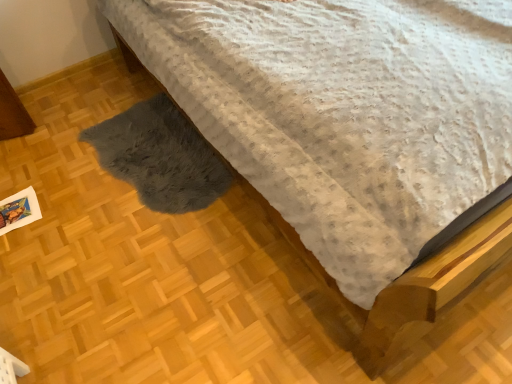
Locate an element on the screen. The width and height of the screenshot is (512, 384). gray furry mat at lower left is located at coordinates (160, 157).

This screenshot has height=384, width=512. What do you see at coordinates (160, 157) in the screenshot? I see `gray furry mat at lower left` at bounding box center [160, 157].

Locate an element on the screen. The height and width of the screenshot is (384, 512). gray furry mat at lower left is located at coordinates (160, 157).